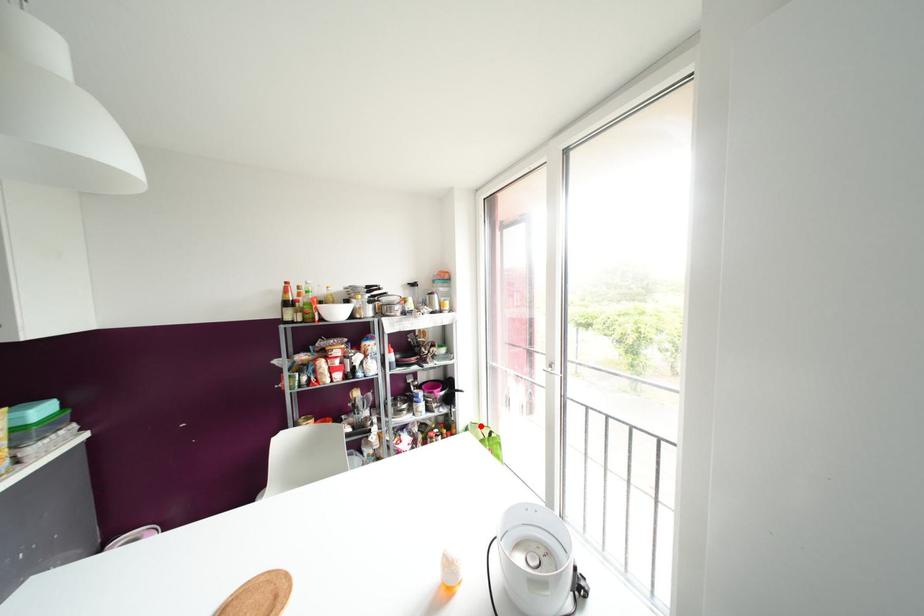
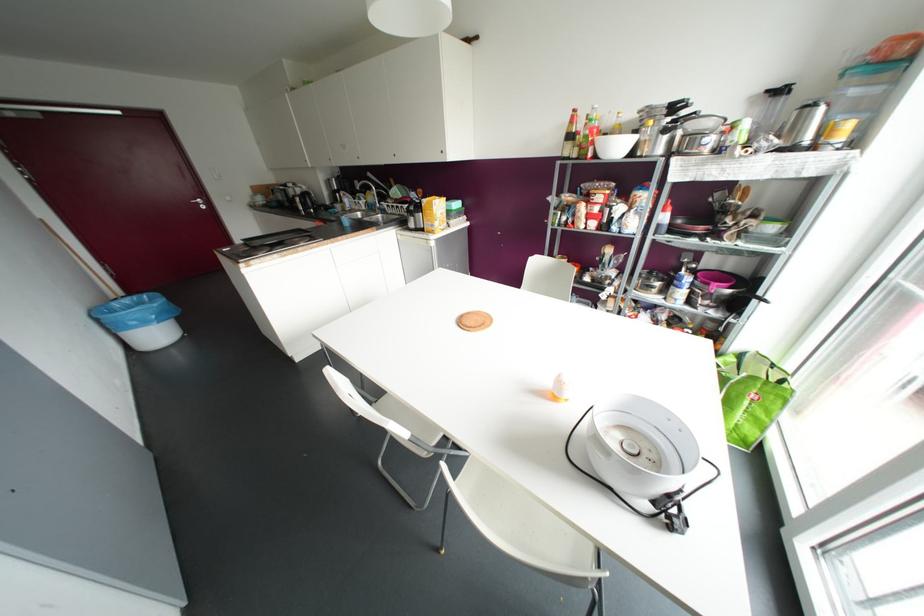
Locate, in the second image, the point that corresponds to the highlighted location in the first image.

(772, 365)